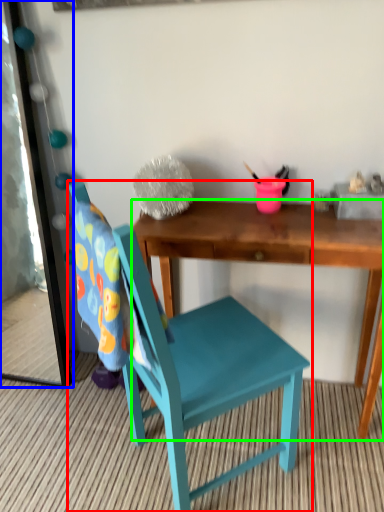
Question: Considering the real-world distances, which object is farthest from chair (highlighted by a red box)? mirror (highlighted by a blue box) or desk (highlighted by a green box)?

Choices:
 (A) mirror
 (B) desk

Answer: (A)